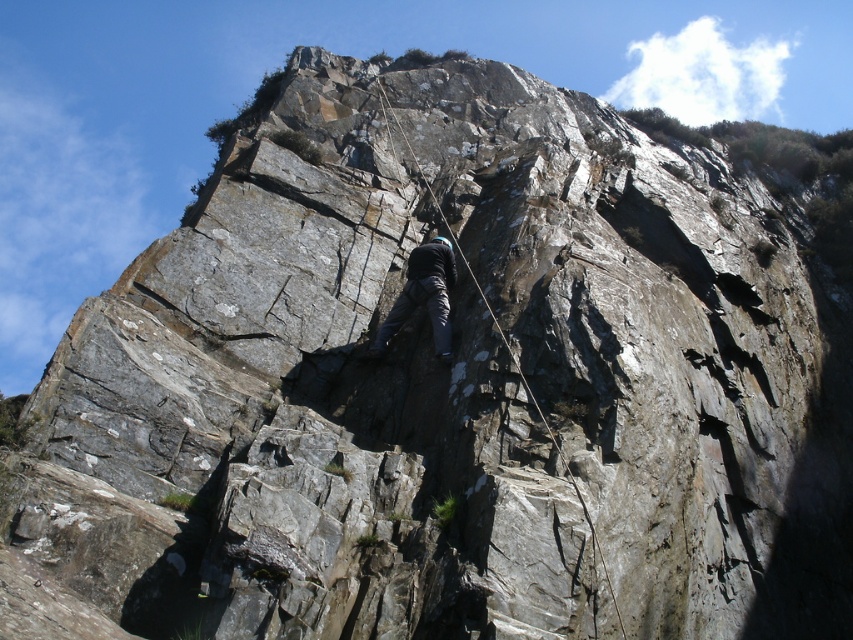
Is dark blue fabric at center to the right of rope at center from the viewer's perspective?

Incorrect, dark blue fabric at center is not on the right side of rope at center.

Who is more distant from viewer, [428,248] or [485,305]?

Point [428,248]

You are a GUI agent. You are given a task and a screenshot of the screen. Output one action in this format:
    pyautogui.click(x=<x>, y=<y>)
    Task: Click on the dark blue fabric at center
    This screenshot has width=853, height=640.
    Given the screenshot: What is the action you would take?
    pyautogui.click(x=422, y=296)